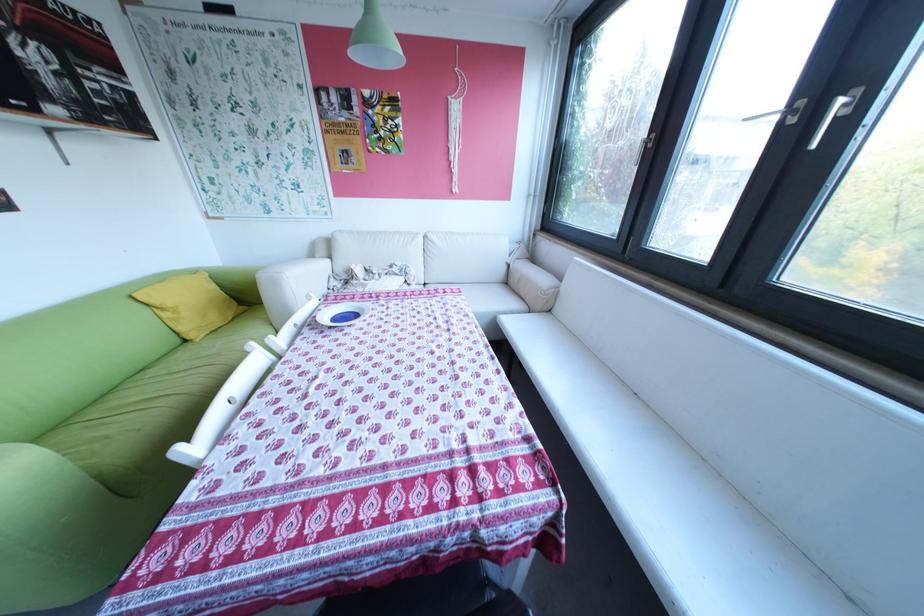
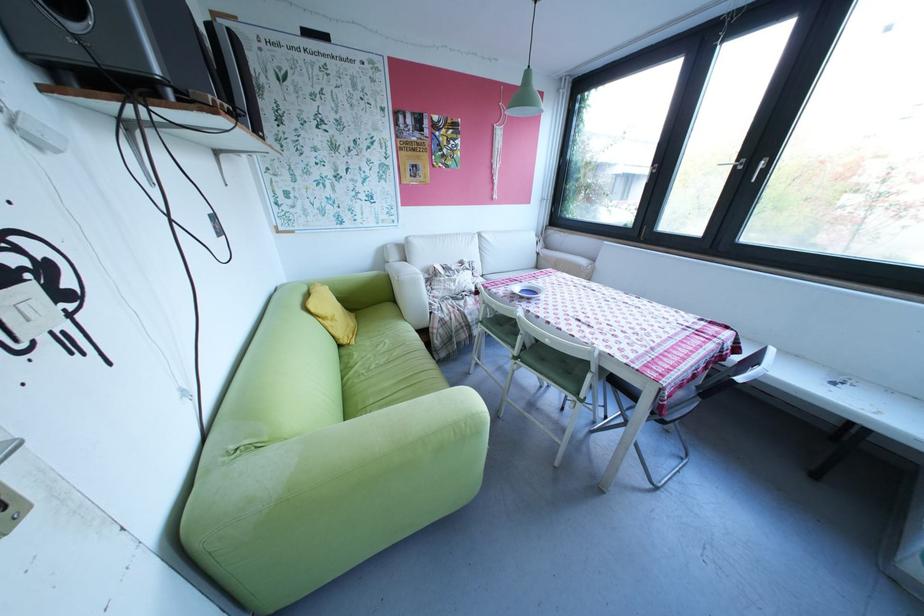
Locate, in the second image, the point that corresponds to (343,326) in the first image.

(541, 299)